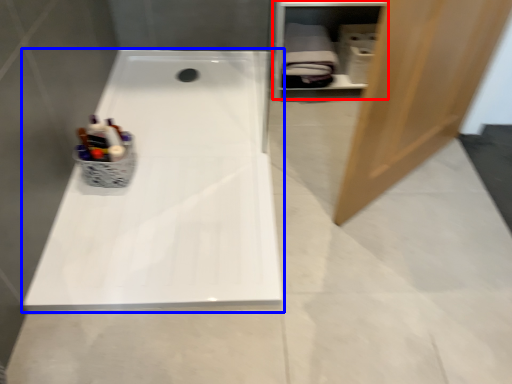
Question: Among these objects, which one is nearest to the camera, shelf (highlighted by a red box) or bathtub (highlighted by a blue box)?

Choices:
 (A) shelf
 (B) bathtub

Answer: (B)